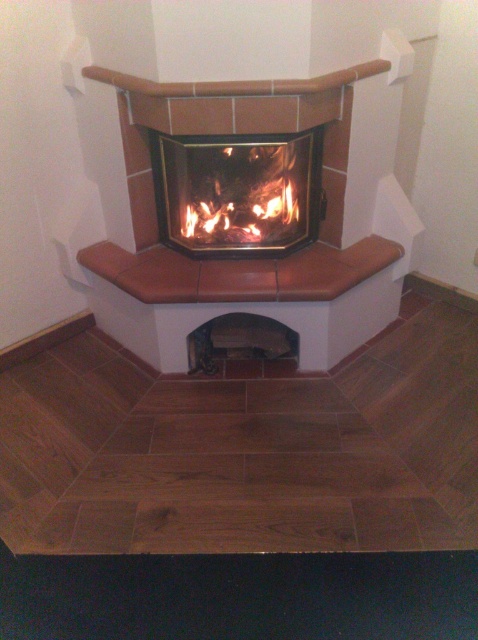
Question: Which object is closer to the camera taking this photo?

Choices:
 (A) matte glass fireplace at center
 (B) orange wood fire at center

Answer: (A)

Question: Where is matte glass fireplace at center located in relation to orange wood fire at center in the image?

Choices:
 (A) right
 (B) left

Answer: (B)

Question: Does matte glass fireplace at center have a greater width compared to orange wood fire at center?

Choices:
 (A) yes
 (B) no

Answer: (A)

Question: Does matte glass fireplace at center appear over orange wood fire at center?

Choices:
 (A) no
 (B) yes

Answer: (B)

Question: Which point appears closest to the camera in this image?

Choices:
 (A) (252, 188)
 (B) (232, 237)

Answer: (A)